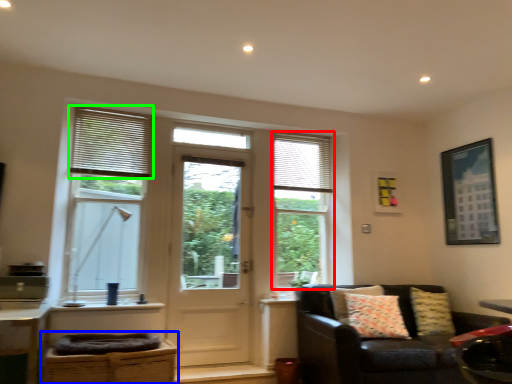
Question: Estimate the real-world distances between objects in this image. Which object is closer to window (highlighted by a red box), swivel chair (highlighted by a blue box) or window blind (highlighted by a green box)?

Choices:
 (A) swivel chair
 (B) window blind

Answer: (B)